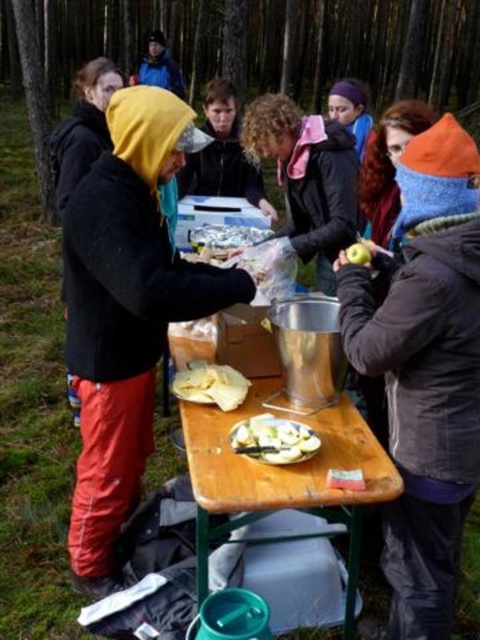
Is matte black jacket at center shorter than white matte plate at center?

Incorrect, matte black jacket at center's height does not fall short of white matte plate at center's.

Who is more distant from viewer, (218, 120) or (297, 452)?

Positioned behind is point (218, 120).

Locate an element on the screen. Image resolution: width=480 pixels, height=640 pixels. matte black jacket at center is located at coordinates pyautogui.click(x=223, y=154).

Does point (257, 428) lie in front of point (217, 232)?

Yes, it is.

Which is more to the right, white matte plate at center or white plastic bag at center?

Positioned to the right is white matte plate at center.

Where is `white matte plate at center`? The image size is (480, 640). white matte plate at center is located at coordinates (274, 440).

Does wooden table at center appear on the left side of white crumbly bread at center?

Incorrect, wooden table at center is not on the left side of white crumbly bread at center.

Can you confirm if wooden table at center is thinner than white crumbly bread at center?

In fact, wooden table at center might be wider than white crumbly bread at center.

I want to click on wooden table at center, so click(x=283, y=472).